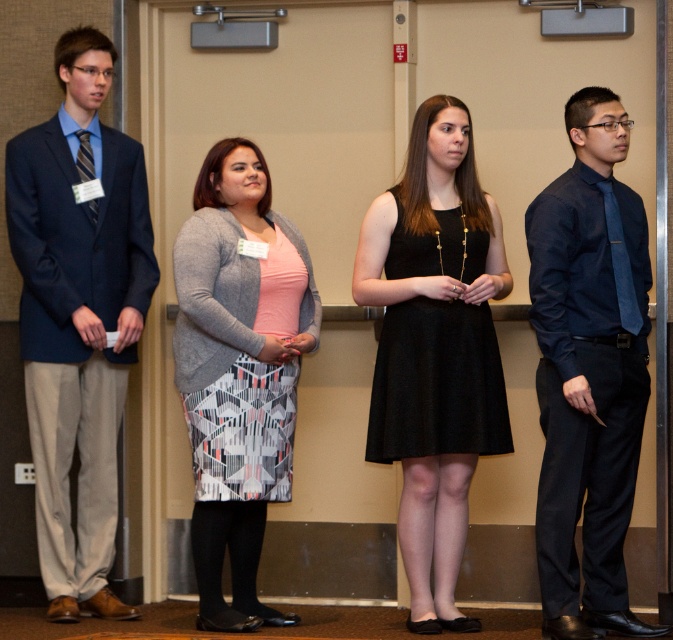
You are a photographer setting up for a group photo. You need to position the black satin dress at center and the navy blue shirt at right so they are exactly 18 inches apart. Based on their current positions, is this adjustment possible without moving the other people?

The black satin dress at center is currently 20.12 inches away from the navy blue shirt at right. Since 20.12 inches is greater than 18 inches, you can move them closer to achieve the desired distance.